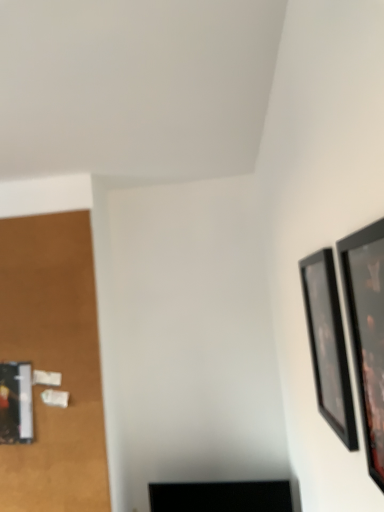
This screenshot has width=384, height=512. Describe the element at coordinates (367, 332) in the screenshot. I see `black glossy picture frame at upper right, which ranks as the first picture frame in front-to-back order` at that location.

The height and width of the screenshot is (512, 384). What are the coordinates of `black glossy picture frame at right, which is the first picture frame from back to front` in the screenshot? It's located at (328, 345).

Is black glossy picture frame at upper right, which ranks as the first picture frame in front-to-back order, at the left side of black glossy picture frame at right, which is the first picture frame from back to front?

Correct, you'll find black glossy picture frame at upper right, which ranks as the first picture frame in front-to-back order, to the left of black glossy picture frame at right, which is the first picture frame from back to front.

Are black glossy picture frame at upper right, arranged as the 2th picture frame when viewed from the back, and black glossy picture frame at right, the second picture frame positioned from the front, beside each other?

No, black glossy picture frame at upper right, arranged as the 2th picture frame when viewed from the back, is not with black glossy picture frame at right, the second picture frame positioned from the front.

Consider the image. Could you tell me if black glossy picture frame at upper right, arranged as the 2th picture frame when viewed from the back, is facing black glossy picture frame at right, the second picture frame positioned from the front?

No.

Considering the sizes of black glossy picture frame at upper right, arranged as the 2th picture frame when viewed from the back, and black glossy picture frame at right, which is the first picture frame from back to front, in the image, is black glossy picture frame at upper right, arranged as the 2th picture frame when viewed from the back, bigger or smaller than black glossy picture frame at right, which is the first picture frame from back to front,?

Considering their sizes, black glossy picture frame at upper right, arranged as the 2th picture frame when viewed from the back, takes up more space than black glossy picture frame at right, which is the first picture frame from back to front.

Which is closer to the camera, [312,330] or [353,321]?

Point [312,330] is positioned farther from the camera compared to point [353,321].

Considering the relative positions of black glossy picture frame at right, which is the first picture frame from back to front, and black glossy picture frame at upper right, arranged as the 2th picture frame when viewed from the back, in the image provided, is black glossy picture frame at right, which is the first picture frame from back to front, to the left of black glossy picture frame at upper right, arranged as the 2th picture frame when viewed from the back, from the viewer's perspective?

Incorrect, black glossy picture frame at right, which is the first picture frame from back to front, is not on the left side of black glossy picture frame at upper right, arranged as the 2th picture frame when viewed from the back.

Consider the image. Between black glossy picture frame at right, which is the first picture frame from back to front, and black glossy picture frame at upper right, arranged as the 2th picture frame when viewed from the back, which one is positioned in front?

black glossy picture frame at upper right, arranged as the 2th picture frame when viewed from the back, is in front.

Which of these two, black glossy picture frame at right, which is the first picture frame from back to front, or black glossy picture frame at upper right, arranged as the 2th picture frame when viewed from the back, stands shorter?

black glossy picture frame at right, which is the first picture frame from back to front.

Is black glossy picture frame at right, which is the first picture frame from back to front, taller than black glossy tv at lower center?

Yes, black glossy picture frame at right, which is the first picture frame from back to front, is taller than black glossy tv at lower center.

Can you confirm if black glossy picture frame at right, the second picture frame positioned from the front, is bigger than black glossy tv at lower center?

No.

Considering the positions of point (346, 395) and point (150, 490), is point (346, 395) closer or farther from the camera than point (150, 490)?

Point (346, 395) appears to be closer to the viewer than point (150, 490).

Does black glossy tv at lower center have a greater width compared to black glossy picture frame at upper right, arranged as the 2th picture frame when viewed from the back?

Yes, black glossy tv at lower center is wider than black glossy picture frame at upper right, arranged as the 2th picture frame when viewed from the back.

Is the depth of black glossy tv at lower center greater than that of black glossy picture frame at upper right, which ranks as the first picture frame in front-to-back order?

That is True.

Is black glossy tv at lower center turned away from black glossy picture frame at upper right, arranged as the 2th picture frame when viewed from the back?

No.

Is black glossy tv at lower center positioned behind black glossy picture frame at right, the second picture frame positioned from the front?

Yes, black glossy tv at lower center is further from the viewer.

Would you consider black glossy tv at lower center to be distant from black glossy picture frame at right, the second picture frame positioned from the front?

black glossy tv at lower center is positioned a significant distance from black glossy picture frame at right, the second picture frame positioned from the front.

From the image's perspective, which one is positioned lower, black glossy tv at lower center or black glossy picture frame at right, which is the first picture frame from back to front?

black glossy tv at lower center.

Could you tell me if black glossy tv at lower center is facing black glossy picture frame at right, the second picture frame positioned from the front?

No, black glossy tv at lower center is not aimed at black glossy picture frame at right, the second picture frame positioned from the front.

Is black glossy picture frame at upper right, arranged as the 2th picture frame when viewed from the back, oriented away from black glossy tv at lower center?

That's not correct — black glossy picture frame at upper right, arranged as the 2th picture frame when viewed from the back, is not looking away from black glossy tv at lower center.

Which of these two, black glossy picture frame at upper right, arranged as the 2th picture frame when viewed from the back, or black glossy tv at lower center, is bigger?

black glossy tv at lower center.

Is black glossy picture frame at upper right, arranged as the 2th picture frame when viewed from the back, touching black glossy tv at lower center?

No, black glossy picture frame at upper right, arranged as the 2th picture frame when viewed from the back, is not with black glossy tv at lower center.

From a real-world perspective, is black glossy picture frame at upper right, arranged as the 2th picture frame when viewed from the back, above or below black glossy tv at lower center?

Clearly, from a real-world perspective, black glossy picture frame at upper right, arranged as the 2th picture frame when viewed from the back, is above black glossy tv at lower center.

Identify the location of picture frame above the black glossy picture frame at right, which is the first picture frame from back to front (from a real-world perspective). (367, 332).

The width and height of the screenshot is (384, 512). Identify the location of picture frame on the right of black glossy picture frame at upper right, which ranks as the first picture frame in front-to-back order. (328, 345).

Looking at the image, which one is located further to black glossy tv at lower center, black glossy picture frame at right, the second picture frame positioned from the front, or black glossy picture frame at upper right, arranged as the 2th picture frame when viewed from the back?

Based on the image, black glossy picture frame at upper right, arranged as the 2th picture frame when viewed from the back, appears to be further to black glossy tv at lower center.

From the image, which object appears to be farther from black glossy picture frame at right, which is the first picture frame from back to front, black glossy tv at lower center or black glossy picture frame at upper right, which ranks as the first picture frame in front-to-back order?

black glossy tv at lower center is further to black glossy picture frame at right, which is the first picture frame from back to front.

Considering their positions, is black glossy picture frame at right, which is the first picture frame from back to front, positioned further to black glossy picture frame at upper right, arranged as the 2th picture frame when viewed from the back, than black glossy tv at lower center?

black glossy tv at lower center lies further to black glossy picture frame at upper right, arranged as the 2th picture frame when viewed from the back, than the other object.

Looking at the image, which one is located further to black glossy picture frame at upper right, which ranks as the first picture frame in front-to-back order, black glossy tv at lower center or black glossy picture frame at right, the second picture frame positioned from the front?

Among the two, black glossy tv at lower center is located further to black glossy picture frame at upper right, which ranks as the first picture frame in front-to-back order.

When comparing their distances from black glossy tv at lower center, does black glossy picture frame at upper right, which ranks as the first picture frame in front-to-back order, or black glossy picture frame at right, which is the first picture frame from back to front, seem closer?

black glossy picture frame at right, which is the first picture frame from back to front, lies closer to black glossy tv at lower center than the other object.

When comparing their distances from black glossy picture frame at right, which is the first picture frame from back to front, does black glossy picture frame at upper right, which ranks as the first picture frame in front-to-back order, or black glossy tv at lower center seem further?

The object further to black glossy picture frame at right, which is the first picture frame from back to front, is black glossy tv at lower center.

Where is `picture frame between black glossy picture frame at upper right, arranged as the 2th picture frame when viewed from the back, and black glossy tv at lower center from front to back`? The width and height of the screenshot is (384, 512). picture frame between black glossy picture frame at upper right, arranged as the 2th picture frame when viewed from the back, and black glossy tv at lower center from front to back is located at coordinates (328, 345).